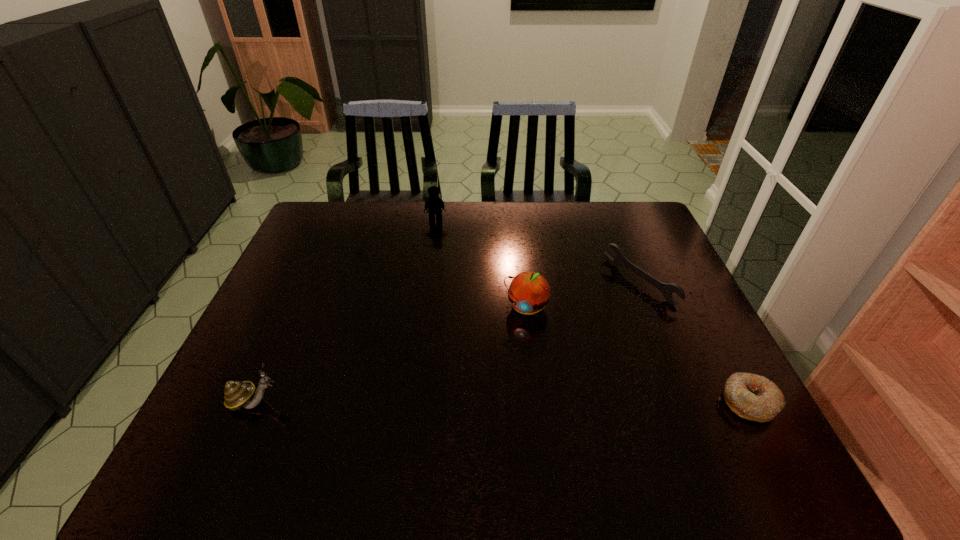
Find the location of a particular element. The image size is (960, 540). the leftmost object is located at coordinates (237, 394).

Find the location of a particular element. This screenshot has height=540, width=960. the shortest object is located at coordinates (753, 397).

At what (x,y) coordinates should I click in order to perform the action: click on the third object from right to left. Please return your answer as a coordinate pair (x, y). This screenshot has height=540, width=960. Looking at the image, I should click on (529, 292).

I want to click on the second object from left to right, so (434, 204).

Image resolution: width=960 pixels, height=540 pixels. I want to click on Lego, so click(434, 204).

At what (x,y) coordinates should I click in order to perform the action: click on wrench. Please return your answer as a coordinate pair (x, y). Image resolution: width=960 pixels, height=540 pixels. Looking at the image, I should click on (666, 289).

Locate an element on the screen. vacant space located on the face of the leftmost object is located at coordinates (460, 402).

At what (x,y) coordinates should I click in order to perform the action: click on vacant space positioned 0.300m on the left of the doughnut. Please return your answer as a coordinate pair (x, y). Looking at the image, I should click on (588, 402).

This screenshot has height=540, width=960. I want to click on vacant space situated on the surface of the third object from left to right, so click(508, 352).

You are a GUI agent. You are given a task and a screenshot of the screen. Output one action in this format:
    pyautogui.click(x=<x>, y=<y>)
    Task: Click on the free space located 0.180m on the surface of the third object from left to right
    Image resolution: width=960 pixels, height=540 pixels.
    Given the screenshot: What is the action you would take?
    pyautogui.click(x=499, y=374)